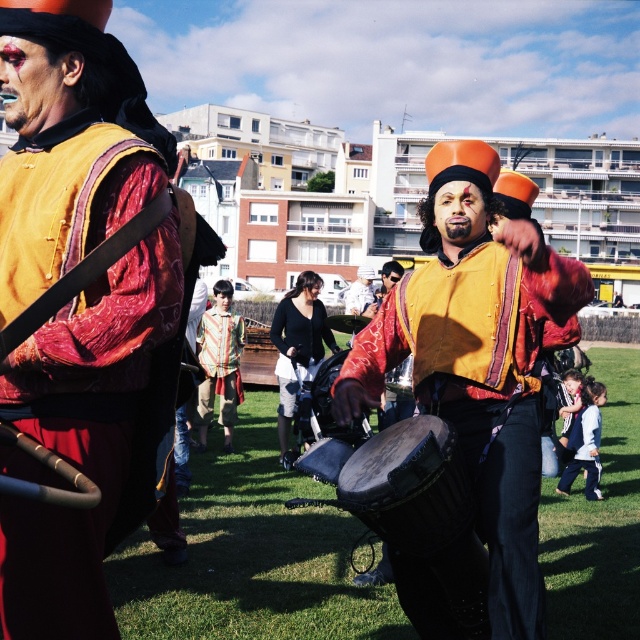
Question: Based on their relative distances, which object is farther from the matte red fabric at left?

Choices:
 (A) striped fabric shirt at center
 (B) smooth dark brown drum at center
 (C) matte yellow vest at center
 (D) black cotton shirt at center

Answer: (A)

Question: Is matte orange drum at center closer to camera compared to dark brown leather drum at center?

Choices:
 (A) no
 (B) yes

Answer: (B)

Question: Which point appears farthest from the camera in this image?

Choices:
 (A) (496, 534)
 (B) (570, 445)
 (C) (394, 392)

Answer: (B)

Question: Can you confirm if matte orange drum at center is thinner than matte red fabric at left?

Choices:
 (A) yes
 (B) no

Answer: (B)

Question: Considering the real-world distances, which object is closest to the smooth dark brown drum at center?

Choices:
 (A) striped fabric shirt at center
 (B) dark brown leather drum at center
 (C) matte red fabric at left
 (D) matte yellow vest at center

Answer: (B)

Question: Considering the relative positions of matte red fabric at left and dark brown leather drum at center in the image provided, where is matte red fabric at left located with respect to dark brown leather drum at center?

Choices:
 (A) above
 (B) below

Answer: (A)